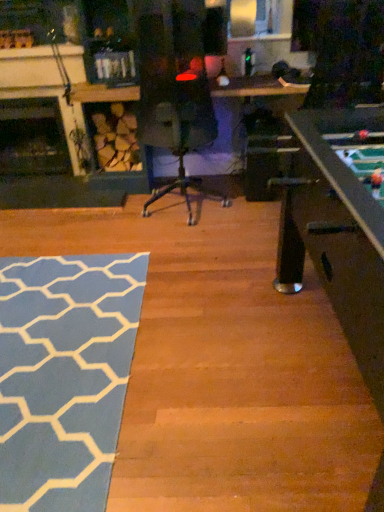
I want to click on dark wood fireplace at left, the first fireplace when ordered from front to back, so (x=39, y=86).

What is the approximate width of blue textured rug at lower left?

blue textured rug at lower left is 5.15 feet wide.

What do you see at coordinates (64, 376) in the screenshot? I see `blue textured rug at lower left` at bounding box center [64, 376].

Where is `dark wood fireplace at left, acting as the 2th fireplace starting from the front`? This screenshot has height=512, width=384. dark wood fireplace at left, acting as the 2th fireplace starting from the front is located at coordinates (32, 138).

From a real-world perspective, is dark wood fireplace at left, the 2th fireplace viewed from the back, beneath blue textured rug at lower left?

Actually, dark wood fireplace at left, the 2th fireplace viewed from the back, is physically above blue textured rug at lower left in the real world.

Locate an element on the screen. This screenshot has height=512, width=384. the 2nd fireplace above when counting from the blue textured rug at lower left (from the image's perspective) is located at coordinates (39, 86).

Is dark wood fireplace at left, the first fireplace when ordered from front to back, wider or thinner than blue textured rug at lower left?

dark wood fireplace at left, the first fireplace when ordered from front to back, is thinner than blue textured rug at lower left.

Who is smaller, dark wood fireplace at left, the first fireplace when ordered from front to back, or blue textured rug at lower left?

Smaller between the two is blue textured rug at lower left.

From a real-world perspective, which object rests below the other?

blue textured rug at lower left.

Looking at this image, are blue textured rug at lower left and dark wood fireplace at left, which is counted as the 1th fireplace, starting from the back, far apart?

Indeed, blue textured rug at lower left is not near dark wood fireplace at left, which is counted as the 1th fireplace, starting from the back.

Which is more to the left, blue textured rug at lower left or dark wood fireplace at left, which is counted as the 1th fireplace, starting from the back?

dark wood fireplace at left, which is counted as the 1th fireplace, starting from the back.

Is blue textured rug at lower left turned away from dark wood fireplace at left, acting as the 2th fireplace starting from the front?

No, blue textured rug at lower left's orientation is not away from dark wood fireplace at left, acting as the 2th fireplace starting from the front.

Does dark wood fireplace at left, acting as the 2th fireplace starting from the front, come in front of blue textured rug at lower left?

No.

From the picture: Is dark wood fireplace at left, which is counted as the 1th fireplace, starting from the back, wider than blue textured rug at lower left?

No, dark wood fireplace at left, which is counted as the 1th fireplace, starting from the back, is not wider than blue textured rug at lower left.

How many degrees apart are the facing directions of dark wood fireplace at left, acting as the 2th fireplace starting from the front, and blue textured rug at lower left?

There is a 0.829-degree angle between the facing directions of dark wood fireplace at left, acting as the 2th fireplace starting from the front, and blue textured rug at lower left.

Between dark wood fireplace at left, acting as the 2th fireplace starting from the front, and blue textured rug at lower left, which one appears on the right side from the viewer's perspective?

From the viewer's perspective, blue textured rug at lower left appears more on the right side.

Is dark wood fireplace at left, the first fireplace when ordered from front to back, located within blue textured rug at lower left?

No, blue textured rug at lower left does not contain dark wood fireplace at left, the first fireplace when ordered from front to back.

Looking at this image, from the image's perspective, is blue textured rug at lower left positioned above or below dark wood fireplace at left, the 2th fireplace viewed from the back?

blue textured rug at lower left is situated lower than dark wood fireplace at left, the 2th fireplace viewed from the back, in the image.

Are blue textured rug at lower left and dark wood fireplace at left, the 2th fireplace viewed from the back, beside each other?

No, blue textured rug at lower left is not touching dark wood fireplace at left, the 2th fireplace viewed from the back.

Looking at this image, looking at their sizes, would you say blue textured rug at lower left is wider or thinner than dark wood fireplace at left, the 2th fireplace viewed from the back?

Considering their sizes, blue textured rug at lower left looks broader than dark wood fireplace at left, the 2th fireplace viewed from the back.

Is dark wood fireplace at left, acting as the 2th fireplace starting from the front, oriented towards dark wood fireplace at left, the 2th fireplace viewed from the back?

Yes, dark wood fireplace at left, acting as the 2th fireplace starting from the front, is oriented towards dark wood fireplace at left, the 2th fireplace viewed from the back.

How far apart are dark wood fireplace at left, which is counted as the 1th fireplace, starting from the back, and dark wood fireplace at left, the first fireplace when ordered from front to back?

A distance of 13.77 inches exists between dark wood fireplace at left, which is counted as the 1th fireplace, starting from the back, and dark wood fireplace at left, the first fireplace when ordered from front to back.

Considering the relative positions of dark wood fireplace at left, which is counted as the 1th fireplace, starting from the back, and dark wood fireplace at left, the first fireplace when ordered from front to back, in the image provided, is dark wood fireplace at left, which is counted as the 1th fireplace, starting from the back, to the right of dark wood fireplace at left, the first fireplace when ordered from front to back, from the viewer's perspective?

No.

From the picture: Considering the sizes of dark wood fireplace at left, acting as the 2th fireplace starting from the front, and dark wood fireplace at left, the first fireplace when ordered from front to back, in the image, is dark wood fireplace at left, acting as the 2th fireplace starting from the front, bigger or smaller than dark wood fireplace at left, the first fireplace when ordered from front to back,?

Considering their sizes, dark wood fireplace at left, acting as the 2th fireplace starting from the front, takes up more space than dark wood fireplace at left, the first fireplace when ordered from front to back.

In the scene shown: Which object is thinner, dark wood fireplace at left, the 2th fireplace viewed from the back, or dark wood fireplace at left, which is counted as the 1th fireplace, starting from the back?

With smaller width is dark wood fireplace at left, the 2th fireplace viewed from the back.

Does dark wood fireplace at left, the first fireplace when ordered from front to back, have a greater height compared to dark wood fireplace at left, acting as the 2th fireplace starting from the front?

Indeed, dark wood fireplace at left, the first fireplace when ordered from front to back, has a greater height compared to dark wood fireplace at left, acting as the 2th fireplace starting from the front.

Is there a large distance between dark wood fireplace at left, the 2th fireplace viewed from the back, and dark wood fireplace at left, acting as the 2th fireplace starting from the front?

That's not correct — dark wood fireplace at left, the 2th fireplace viewed from the back, is a little close to dark wood fireplace at left, acting as the 2th fireplace starting from the front.

From a real-world perspective, is dark wood fireplace at left, the 2th fireplace viewed from the back, on top of dark wood fireplace at left, which is counted as the 1th fireplace, starting from the back?

Yes.

This screenshot has height=512, width=384. Find the location of `the 1st fireplace behind the blue textured rug at lower left, counting from the anchor's position`. the 1st fireplace behind the blue textured rug at lower left, counting from the anchor's position is located at coordinates (39, 86).

The width and height of the screenshot is (384, 512). What are the coordinates of `mat below the dark wood fireplace at left, which is counted as the 1th fireplace, starting from the back (from the image's perspective)` in the screenshot? It's located at point(64,376).

Looking at the image, which one is located closer to blue textured rug at lower left, dark wood fireplace at left, acting as the 2th fireplace starting from the front, or dark wood fireplace at left, the 2th fireplace viewed from the back?

The object closer to blue textured rug at lower left is dark wood fireplace at left, the 2th fireplace viewed from the back.

Considering their positions, is blue textured rug at lower left positioned closer to dark wood fireplace at left, which is counted as the 1th fireplace, starting from the back, than dark wood fireplace at left, the 2th fireplace viewed from the back?

dark wood fireplace at left, the 2th fireplace viewed from the back, is closer to dark wood fireplace at left, which is counted as the 1th fireplace, starting from the back.

Consider the image. When comparing their distances from dark wood fireplace at left, the 2th fireplace viewed from the back, does dark wood fireplace at left, which is counted as the 1th fireplace, starting from the back, or blue textured rug at lower left seem closer?

dark wood fireplace at left, which is counted as the 1th fireplace, starting from the back, lies closer to dark wood fireplace at left, the 2th fireplace viewed from the back, than the other object.

Based on their spatial positions, is dark wood fireplace at left, the first fireplace when ordered from front to back, or blue textured rug at lower left closer to dark wood fireplace at left, which is counted as the 1th fireplace, starting from the back?

The object closer to dark wood fireplace at left, which is counted as the 1th fireplace, starting from the back, is dark wood fireplace at left, the first fireplace when ordered from front to back.

Based on their spatial positions, is dark wood fireplace at left, the 2th fireplace viewed from the back, or dark wood fireplace at left, which is counted as the 1th fireplace, starting from the back, closer to blue textured rug at lower left?

Based on the image, dark wood fireplace at left, the 2th fireplace viewed from the back, appears to be nearer to blue textured rug at lower left.

Looking at the image, which one is located further to dark wood fireplace at left, the 2th fireplace viewed from the back, blue textured rug at lower left or dark wood fireplace at left, acting as the 2th fireplace starting from the front?

blue textured rug at lower left.

In order to click on fireplace between blue textured rug at lower left and dark wood fireplace at left, acting as the 2th fireplace starting from the front, along the z-axis in this screenshot , I will do `click(39, 86)`.